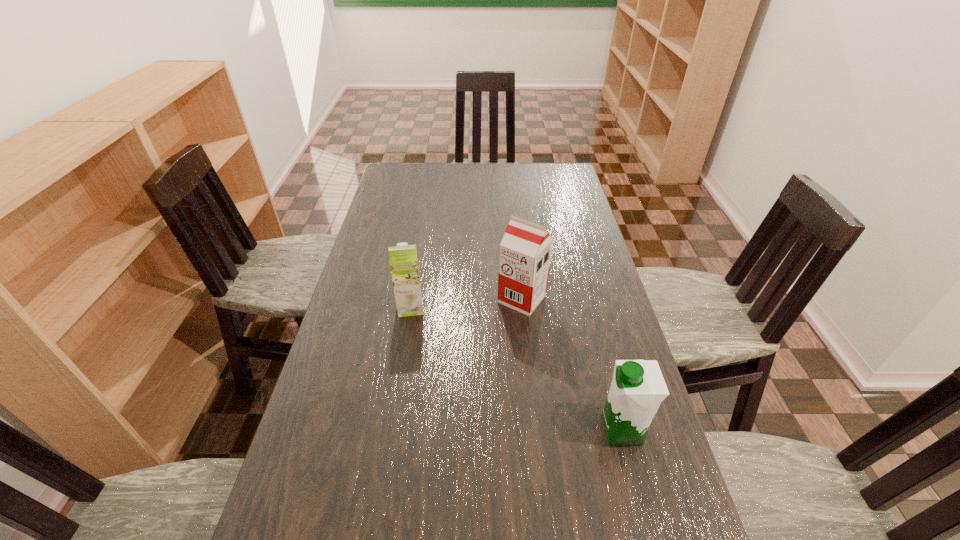
Image resolution: width=960 pixels, height=540 pixels. I want to click on the second soya milk from right to left, so [x=525, y=250].

The image size is (960, 540). Identify the location of the second object from left to right. (525, 250).

Find the location of `the leftmost object`. the leftmost object is located at coordinates (403, 260).

Identify the location of the rightmost object. (638, 387).

The width and height of the screenshot is (960, 540). What are the coordinates of `the nearest soya milk` in the screenshot? It's located at (638, 387).

The image size is (960, 540). Identify the location of free spot located on the back of the tallest soya milk. (516, 248).

The image size is (960, 540). Identify the location of vacant space situated on the left of the leftmost object. (360, 307).

At what (x,y) coordinates should I click in order to perform the action: click on vacant region located on the front-facing side of the nearest object. Please return your answer as a coordinate pair (x, y). The image size is (960, 540). Looking at the image, I should click on (549, 430).

Find the location of a particular element. blank space located on the front-facing side of the nearest object is located at coordinates (x=438, y=430).

Identify the location of vacant point located on the front-facing side of the nearest object. (429, 430).